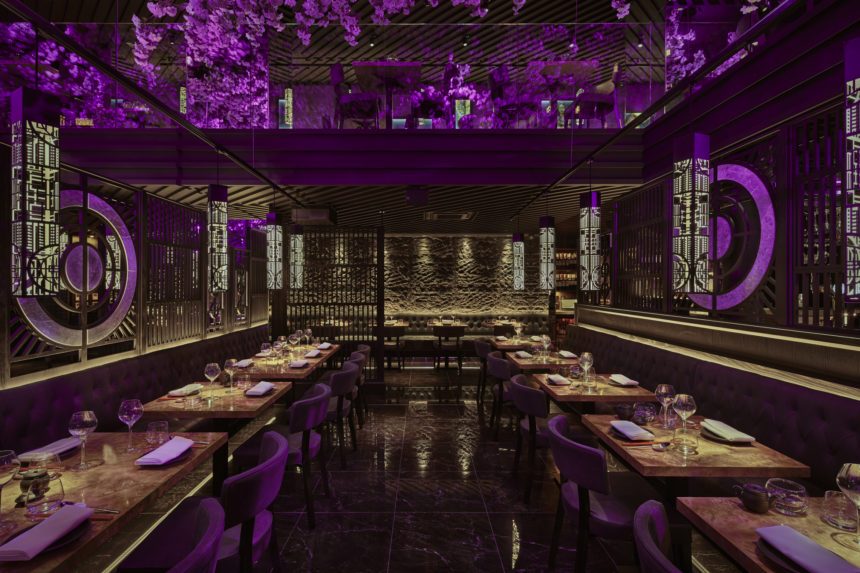
Where is `back wall`? Image resolution: width=860 pixels, height=573 pixels. back wall is located at coordinates (447, 274).